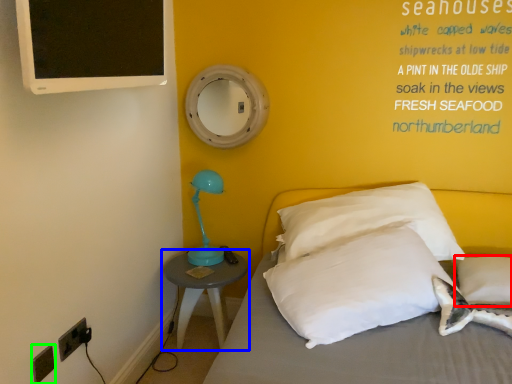
Question: Which is nearer to the pillow (highlighted by a red box)? nightstand (highlighted by a blue box) or electric outlet (highlighted by a green box).

Choices:
 (A) nightstand
 (B) electric outlet

Answer: (A)